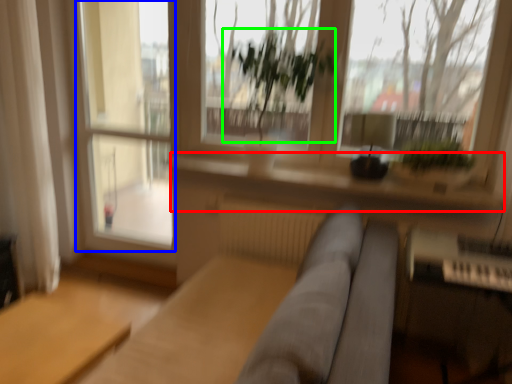
Question: Which is farther away from window sill (highlighted by a red box)? screen door (highlighted by a blue box) or vegetation (highlighted by a green box)?

Choices:
 (A) screen door
 (B) vegetation

Answer: (B)